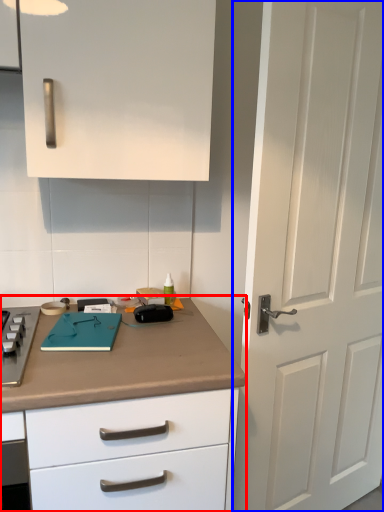
Question: Among these objects, which one is farthest to the camera, countertop (highlighted by a red box) or door (highlighted by a blue box)?

Choices:
 (A) countertop
 (B) door

Answer: (B)